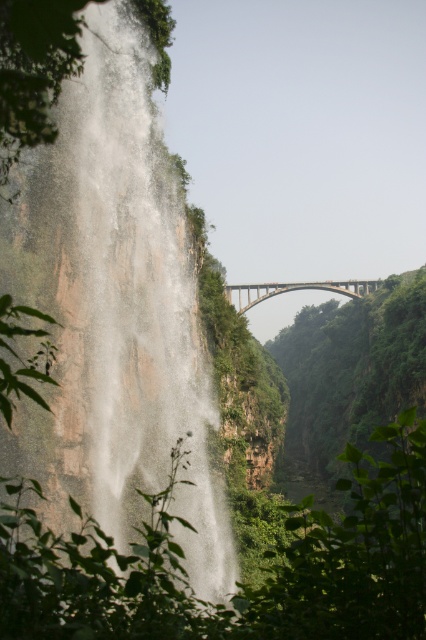
You are standing at the point with coordinates point [115,312]. What do you see around you?

You are at the white misty waterfall at left, which is surrounded by rugged cliffs and lush vegetation.

You are a hiker planning to cross the valley using the brown concrete arch bridge at center. You want to take a photo of the white misty waterfall at left from the bridge. Will the waterfall be fully visible in the photo without any obstruction from the bridge?

The white misty waterfall at left is taller than the brown concrete arch bridge at center, so the waterfall will be visible above the bridge and can be captured in the photo without obstruction.

You are standing at the base of the waterfall in the image and want to reach the bridge in the background. You notice two points marked in the scene, point [88,20] and point [321,289]. Which point should you head towards if you want to get closer to the bridge?

You should head towards point [321,289] because it is further away from the viewer, meaning it is closer to the bridge in the background.